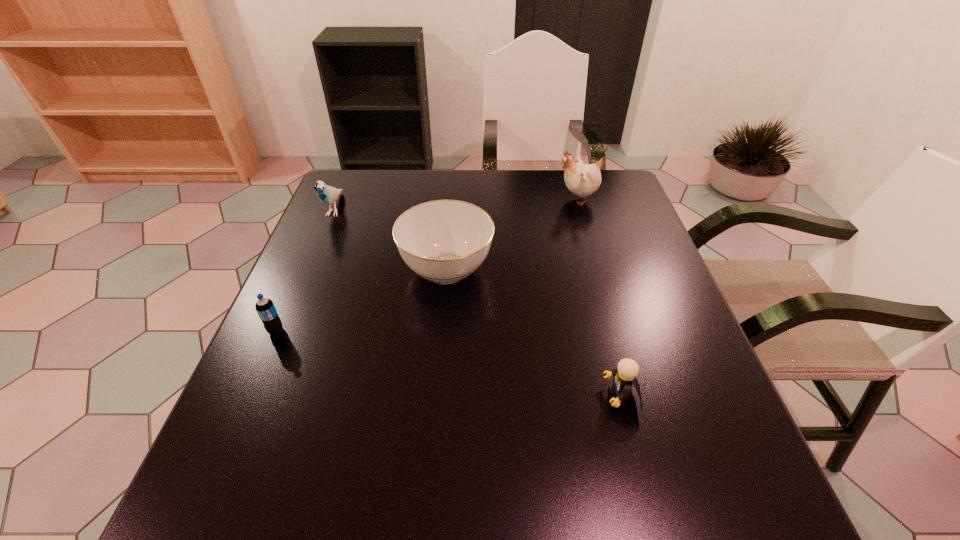
Where is `vacant space that satisfies the following two spatial constraints: 1. at the beak of the right bird; 2. at the face of the shorter bird`? Image resolution: width=960 pixels, height=540 pixels. vacant space that satisfies the following two spatial constraints: 1. at the beak of the right bird; 2. at the face of the shorter bird is located at coordinates (581, 210).